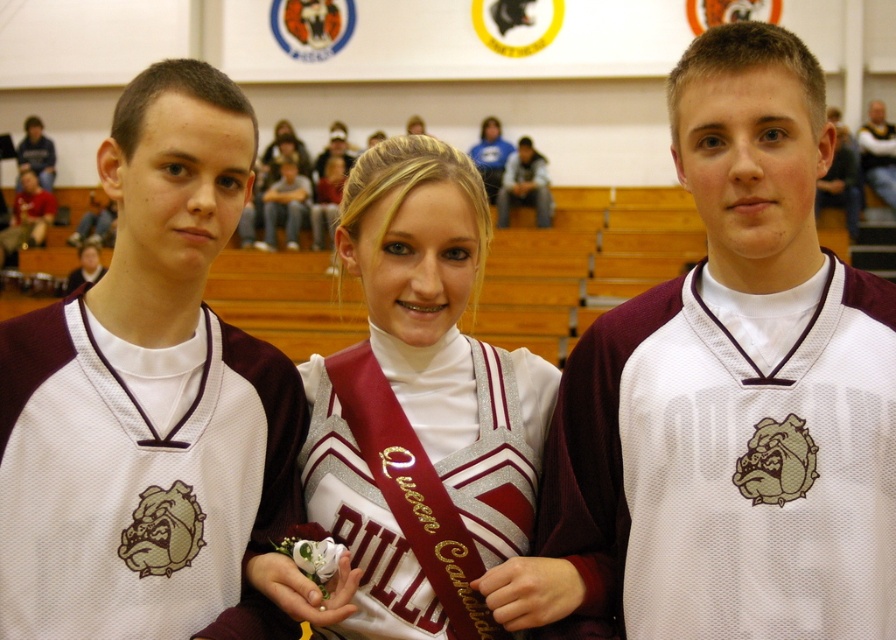
Does matte red shirt at left appear over white satin sash at center?

Actually, matte red shirt at left is below white satin sash at center.

Who is higher up, matte red shirt at left or white satin sash at center?

white satin sash at center

Is point (30, 172) farther from camera compared to point (336, 177)?

That is True.

Where is `matte red shirt at left`? This screenshot has width=896, height=640. matte red shirt at left is located at coordinates (27, 216).

Can you confirm if matte gray jeans at center is smaller than white jersey at center?

No.

Is matte gray jeans at center taller than white jersey at center?

No.

In order to click on matte gray jeans at center in this screenshot , I will do `click(283, 205)`.

Between white mesh jersey at center and maroon satin sash at center, which one appears on the right side from the viewer's perspective?

white mesh jersey at center is more to the right.

This screenshot has width=896, height=640. Describe the element at coordinates (737, 390) in the screenshot. I see `white mesh jersey at center` at that location.

This screenshot has width=896, height=640. I want to click on white mesh jersey at center, so click(737, 390).